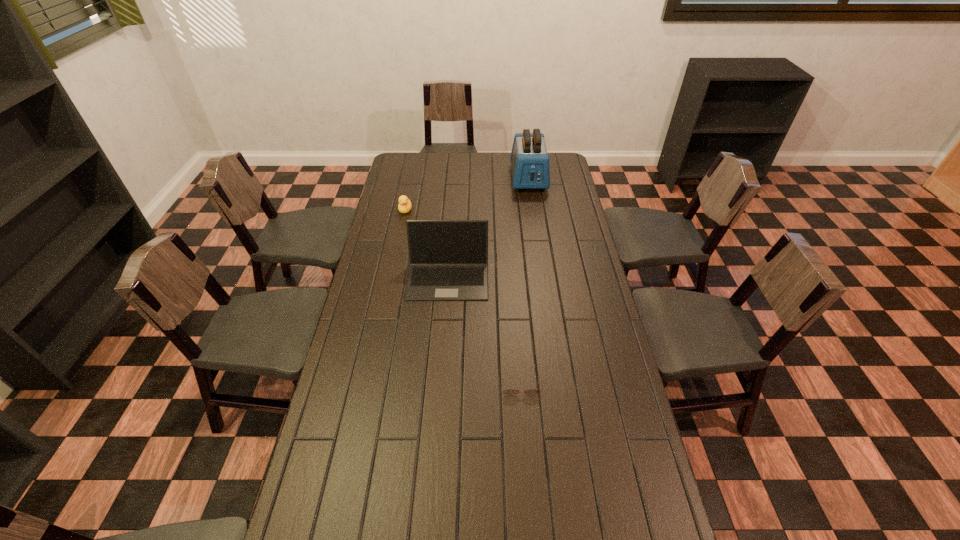
The image size is (960, 540). I want to click on toaster, so click(x=529, y=159).

Identify the location of the farthest object. This screenshot has width=960, height=540. (529, 159).

At what (x,y) coordinates should I click in order to perform the action: click on the second tallest object. Please return your answer as a coordinate pair (x, y). The height and width of the screenshot is (540, 960). Looking at the image, I should click on (448, 259).

Find the location of a particular element. This screenshot has width=960, height=540. laptop is located at coordinates (448, 259).

I want to click on the second shortest object, so click(x=404, y=206).

At what (x,y) coordinates should I click in order to perform the action: click on duckling. Please return your answer as a coordinate pair (x, y). This screenshot has width=960, height=540. Looking at the image, I should click on (404, 206).

This screenshot has width=960, height=540. What are the coordinates of `sunglasses` in the screenshot? It's located at (508, 391).

Image resolution: width=960 pixels, height=540 pixels. I want to click on the shortest object, so click(x=508, y=391).

Where is `vacant area situated on the front-facing side of the tallest object`? The height and width of the screenshot is (540, 960). vacant area situated on the front-facing side of the tallest object is located at coordinates (533, 209).

The height and width of the screenshot is (540, 960). In order to click on vacant space located on the screen of the second nearest object in this screenshot , I will do `click(440, 383)`.